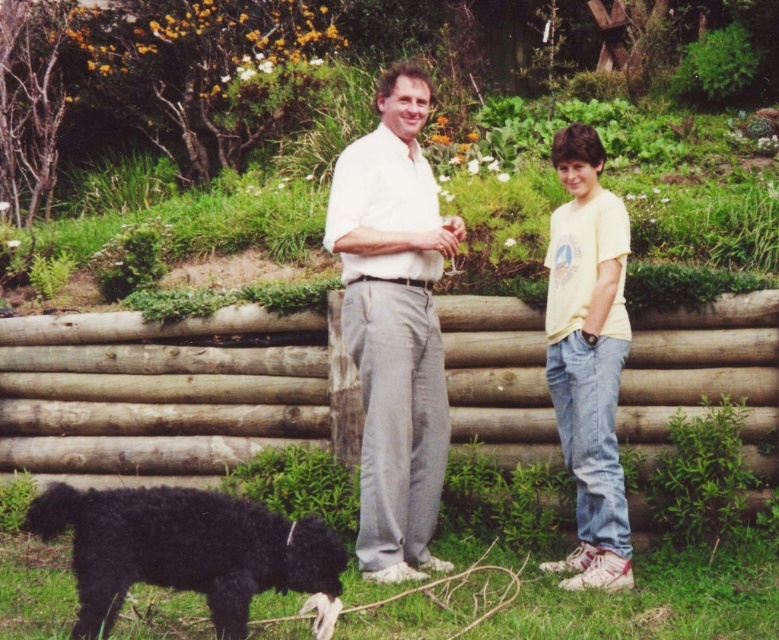
Question: Does white cotton shirt at center appear over black fuzzy dog at lower left?

Choices:
 (A) yes
 (B) no

Answer: (A)

Question: Is white cotton shirt at center bigger than black fuzzy dog at lower left?

Choices:
 (A) yes
 (B) no

Answer: (A)

Question: Among these objects, which one is nearest to the camera?

Choices:
 (A) white cotton shirt at center
 (B) black fuzzy dog at lower left
 (C) yellow cotton shirt at right

Answer: (B)

Question: Where is white cotton shirt at center located in relation to yellow cotton shirt at right in the image?

Choices:
 (A) left
 (B) right

Answer: (A)

Question: Which object is farther from the camera taking this photo?

Choices:
 (A) white cotton shirt at center
 (B) black fuzzy dog at lower left
 (C) yellow cotton shirt at right

Answer: (C)

Question: Which object is closer to the camera taking this photo?

Choices:
 (A) yellow cotton shirt at right
 (B) white cotton shirt at center

Answer: (B)